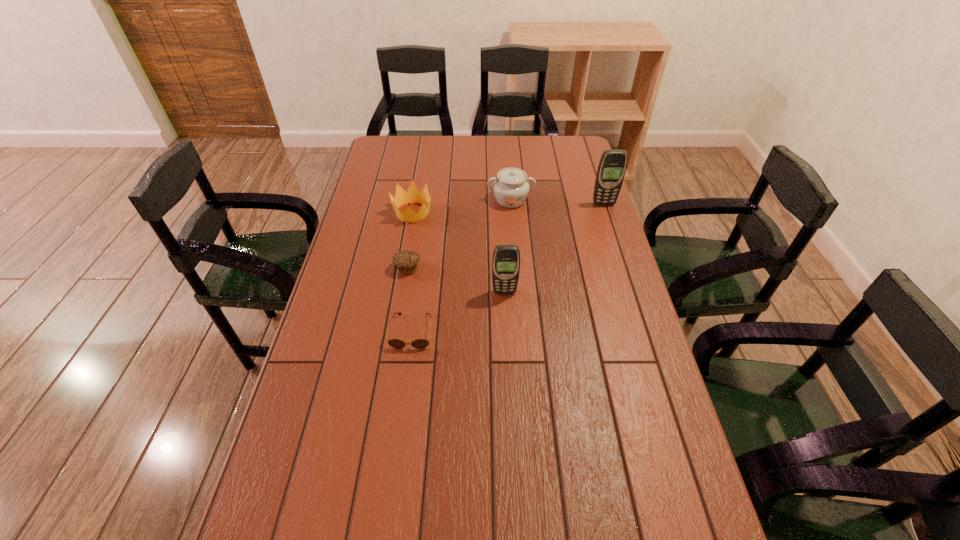
Image resolution: width=960 pixels, height=540 pixels. In order to click on vacant point that satisfies the following two spatial constraints: 1. on the back side of the third shortest object; 2. on the right side of the third tallest object in this screenshot , I will do `click(415, 200)`.

Identify the location of vacant area that satisfies the following two spatial constraints: 1. on the back side of the chinaware; 2. on the right side of the third nearest object. (419, 200).